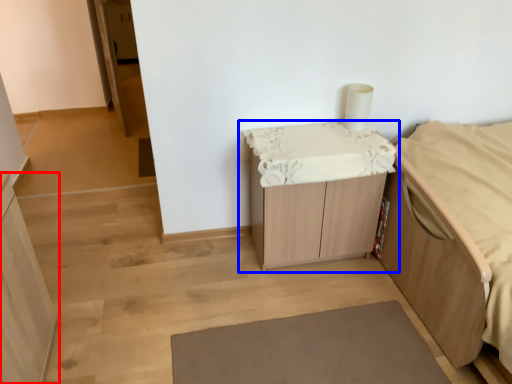
Question: Among these objects, which one is nearest to the camera, cabinetry (highlighted by a red box) or table (highlighted by a blue box)?

Choices:
 (A) cabinetry
 (B) table

Answer: (A)